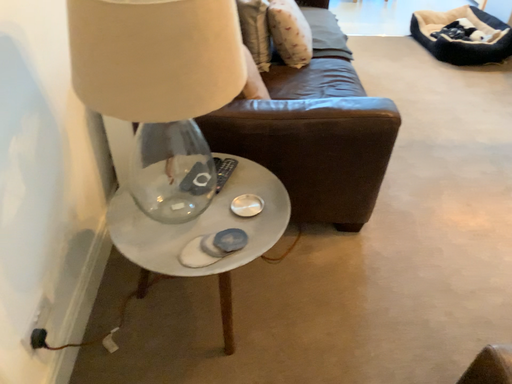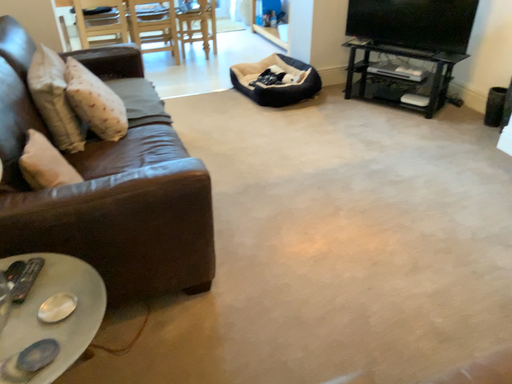
Question: Which way did the camera rotate in the video?

Choices:
 (A) rotated right
 (B) rotated left

Answer: (A)